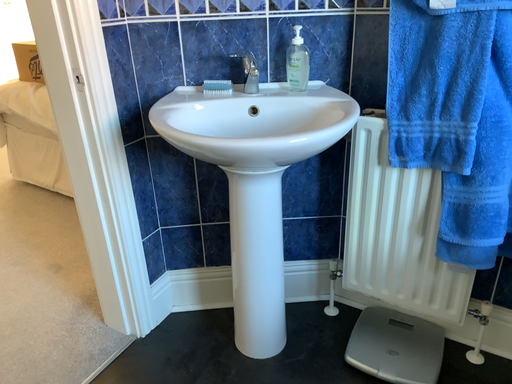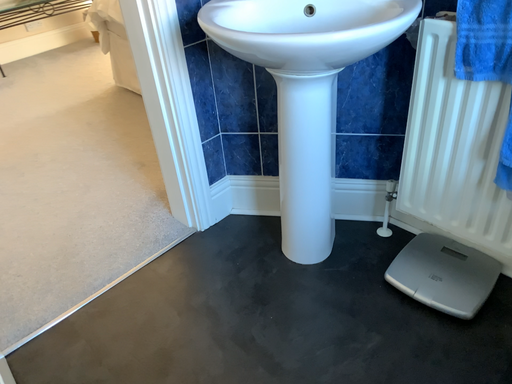
Question: How did the camera likely rotate when shooting the video?

Choices:
 (A) rotated upward
 (B) rotated downward

Answer: (B)